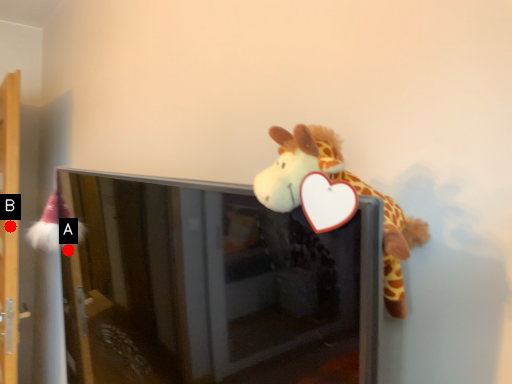
Question: Two points are circled on the image, labeled by A and B beside each circle. Which point is further to the camera?

Choices:
 (A) A is further
 (B) B is further

Answer: (B)